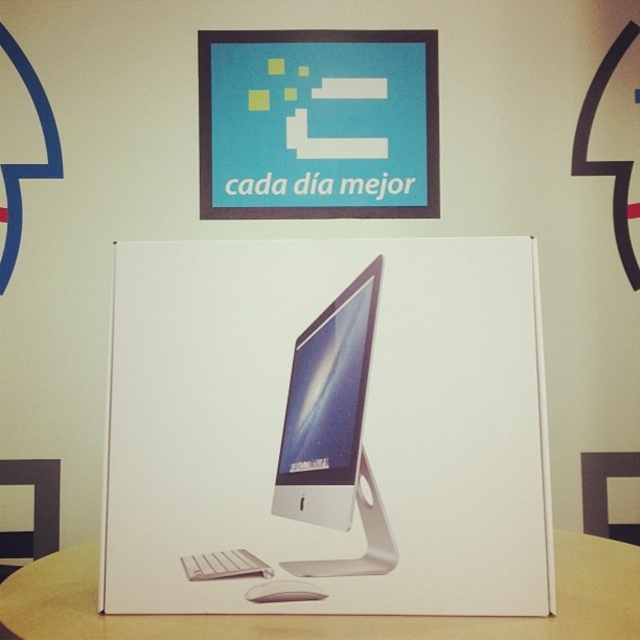
Question: Does wooden table at center appear under white plastic mouse at lower center?

Choices:
 (A) yes
 (B) no

Answer: (A)

Question: Among these objects, which one is nearest to the camera?

Choices:
 (A) white plastic mouse at lower center
 (B) satin silver monitor at center
 (C) wooden table at center
 (D) white glossy desktop computer at center

Answer: (C)

Question: Does wooden table at center have a larger size compared to white plastic mouse at lower center?

Choices:
 (A) yes
 (B) no

Answer: (A)

Question: Which point appears farthest from the camera in this image?

Choices:
 (A) (282, 580)
 (B) (356, 280)

Answer: (B)

Question: Among these objects, which one is farthest from the camera?

Choices:
 (A) white glossy desktop computer at center
 (B) white plastic mouse at lower center

Answer: (B)

Question: Does white glossy desktop computer at center have a larger size compared to wooden table at center?

Choices:
 (A) no
 (B) yes

Answer: (B)